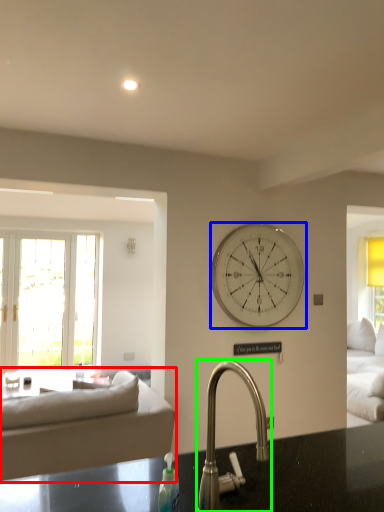
Question: Estimate the real-world distances between objects in this image. Which object is closer to studio couch (highlighted by a red box), wall clock (highlighted by a blue box) or tap (highlighted by a green box)?

Choices:
 (A) wall clock
 (B) tap

Answer: (A)